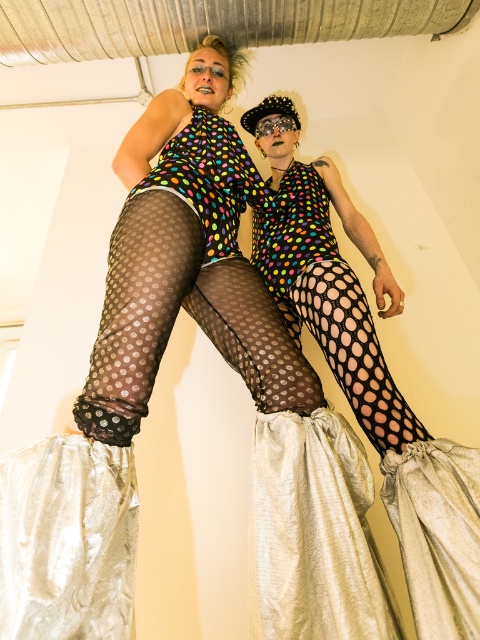
Question: Is polka dot fabric at center to the left of fishnet tights at center from the viewer's perspective?

Choices:
 (A) yes
 (B) no

Answer: (B)

Question: Which point is closer to the camera taking this photo?

Choices:
 (A) (373, 388)
 (B) (199, 305)

Answer: (A)

Question: Which of the following is the closest to the observer?

Choices:
 (A) (297, 134)
 (B) (245, 285)

Answer: (B)

Question: Does polka dot fabric at center lie in front of fishnet tights at center?

Choices:
 (A) yes
 (B) no

Answer: (A)

Question: Which point is closer to the camera taking this photo?

Choices:
 (A) (165, 337)
 (B) (478, 563)

Answer: (B)

Question: Can you confirm if polka dot fabric at center is positioned to the right of fishnet tights at center?

Choices:
 (A) no
 (B) yes

Answer: (B)